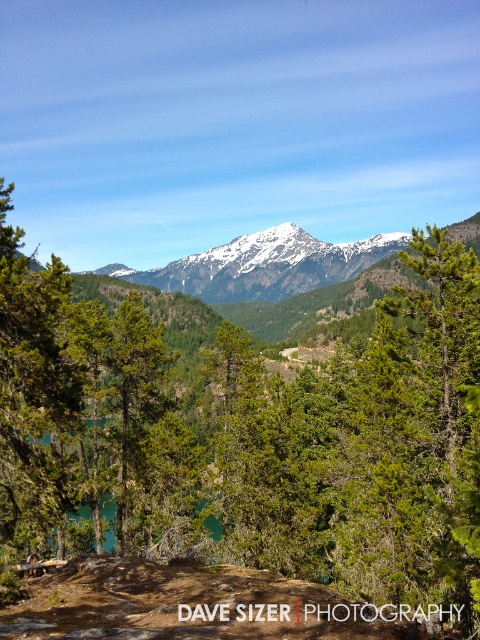
You are a hiker planning to set up a tent between the green leafy tree at center and the green matte tree at left. Which tree has a wider trunk to ensure your tent fits comfortably between them?

The green leafy tree at center might be wider than green matte tree at left, so the tent should be placed between them near the green leafy tree at center for better space.

You are a hiker standing at the base of the mountain and see both the green leafy tree at center and the green matte tree at center. If you want to reach both trees, which one would you need to walk towards first if they are aligned in a straight path?

Both the green leafy tree at center and the green matte tree at center are aligned in a straight path. Since the green leafy tree at center is closer to you, you should walk towards the green leafy tree at center first before proceeding to the green matte tree at center.